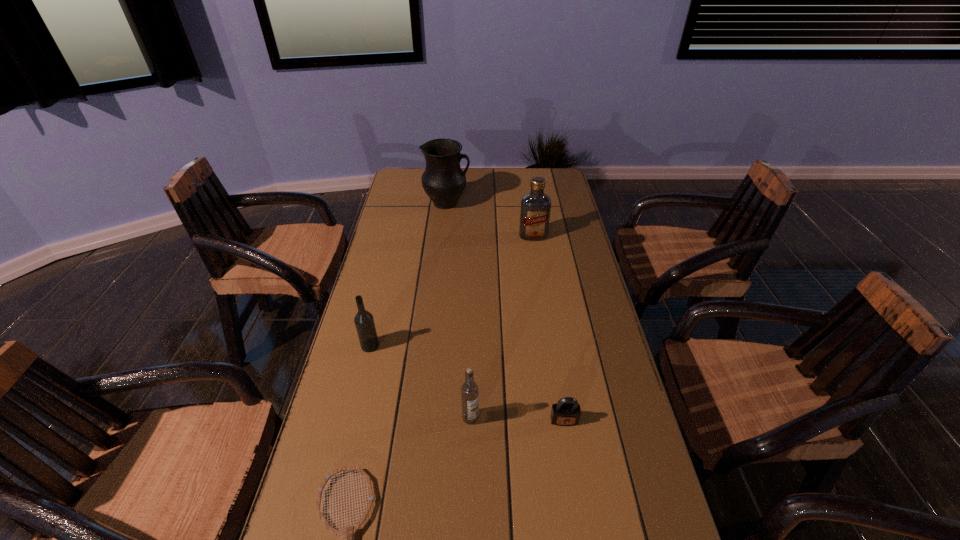
This screenshot has width=960, height=540. In order to click on the closest vodka relative to the fourth nearest object in this screenshot , I will do `click(469, 390)`.